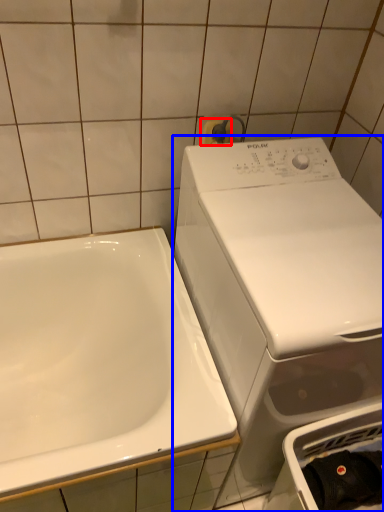
Question: Which object appears closest to the camera in this image, towel bar (highlighted by a red box) or washing machine (highlighted by a blue box)?

Choices:
 (A) towel bar
 (B) washing machine

Answer: (B)